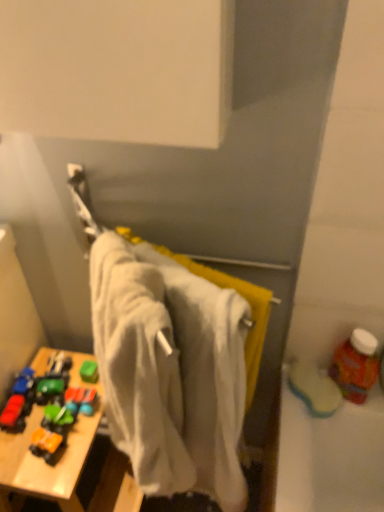
Question: Does rubberized plastic toy car at lower left come behind translucent plastic bottle at right?

Choices:
 (A) yes
 (B) no

Answer: (A)

Question: Is rubberized plastic toy car at lower left next to translucent plastic bottle at right and touching it?

Choices:
 (A) no
 (B) yes

Answer: (A)

Question: Can you confirm if rubberized plastic toy car at lower left is shorter than translucent plastic bottle at right?

Choices:
 (A) no
 (B) yes

Answer: (B)

Question: From the image's perspective, is rubberized plastic toy car at lower left below translucent plastic bottle at right?

Choices:
 (A) no
 (B) yes

Answer: (B)

Question: From a real-world perspective, is rubberized plastic toy car at lower left on top of translucent plastic bottle at right?

Choices:
 (A) yes
 (B) no

Answer: (B)

Question: Is wooden toy at lower left inside or outside of rubberized plastic toy car at lower left?

Choices:
 (A) outside
 (B) inside

Answer: (A)

Question: Is wooden toy at lower left taller or shorter than rubberized plastic toy car at lower left?

Choices:
 (A) tall
 (B) short

Answer: (A)

Question: Considering their positions, is wooden toy at lower left located in front of or behind rubberized plastic toy car at lower left?

Choices:
 (A) front
 (B) behind

Answer: (A)

Question: From a real-world perspective, relative to rubberized plastic toy car at lower left, is wooden toy at lower left vertically above or below?

Choices:
 (A) below
 (B) above

Answer: (A)

Question: Considering the relative positions of translucent plastic bottle at right and white cotton towel at center in the image provided, is translucent plastic bottle at right to the left or to the right of white cotton towel at center?

Choices:
 (A) right
 (B) left

Answer: (A)

Question: Looking at their shapes, would you say translucent plastic bottle at right is wider or thinner than white cotton towel at center?

Choices:
 (A) wide
 (B) thin

Answer: (B)

Question: Looking at the image, does translucent plastic bottle at right seem bigger or smaller compared to white cotton towel at center?

Choices:
 (A) small
 (B) big

Answer: (A)

Question: From a real-world perspective, is translucent plastic bottle at right above or below white cotton towel at center?

Choices:
 (A) above
 (B) below

Answer: (B)

Question: Do you think translucent plastic bottle at right is within wooden toy at lower left, or outside of it?

Choices:
 (A) inside
 (B) outside

Answer: (B)

Question: From the image's perspective, is translucent plastic bottle at right positioned above or below wooden toy at lower left?

Choices:
 (A) above
 (B) below

Answer: (A)